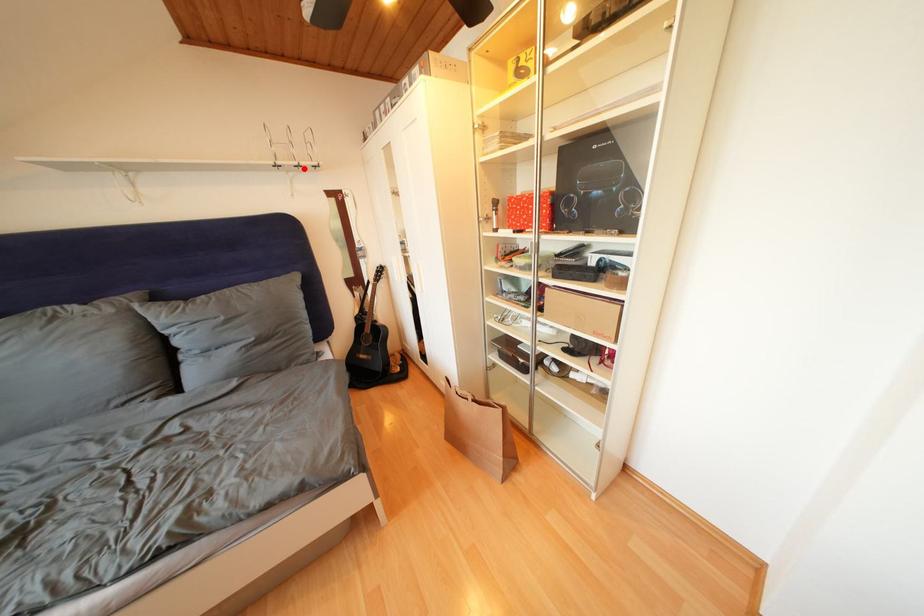
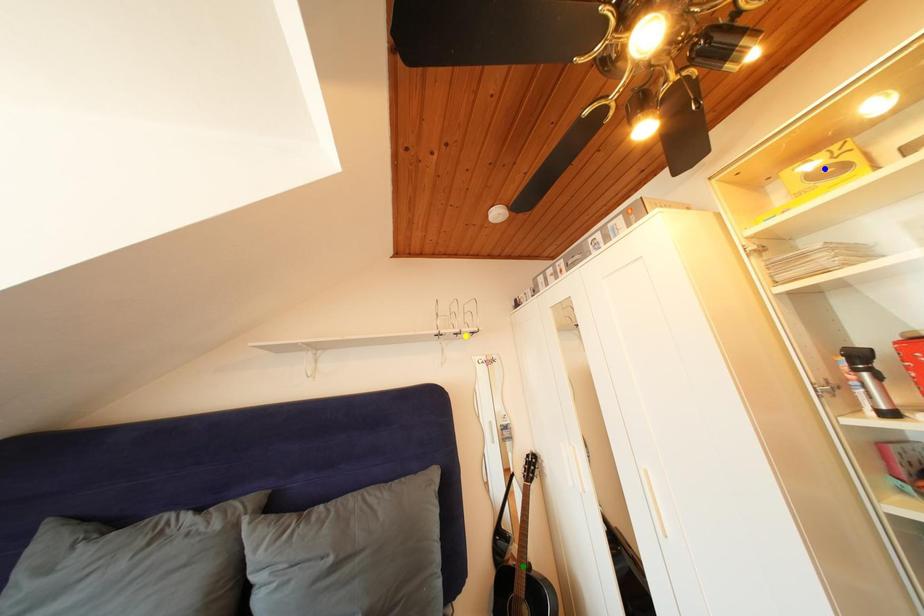
Question: I am providing you with two images of the same scene from different viewpoints. A red point is marked on the first image. You are given multiple points on the second image. Which point in image 2 is actually the same real-world point as the red point in image 1?

Choices:
 (A) blue point
 (B) yellow point
 (C) green point

Answer: (B)